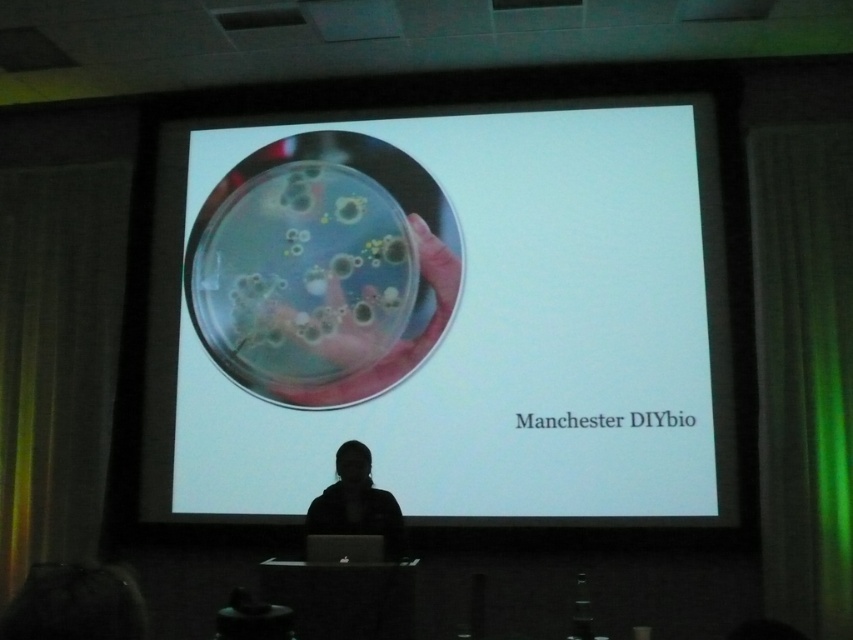
You are sitting in the front row of the presentation and want to see both the green fabric curtain at right and the black matte jacket at lower center. Which object is closer to you?

The green fabric curtain at right is closer to you because it is further to the viewer than the black matte jacket at lower center.

You are an attendee in the presentation and want to exit the room quickly. The green fabric curtain at right is at point 0.580, 0.944. Where should you go to exit the room?

The green fabric curtain at right is at point (804, 371), so you should go to the green fabric curtain at right to exit the room.

You are standing in the presentation room and want to see the projection screen clearly. The point on the screen at coordinate point (839,353) is part of the image you need to focus on. Considering your distance from the screen, can you comfortably see the details at that point without moving closer?

The point (839,353) is 4.58 meters away from you. Since the distance is appropriate for a presentation setup, you can comfortably see the details at that point without needing to move closer.